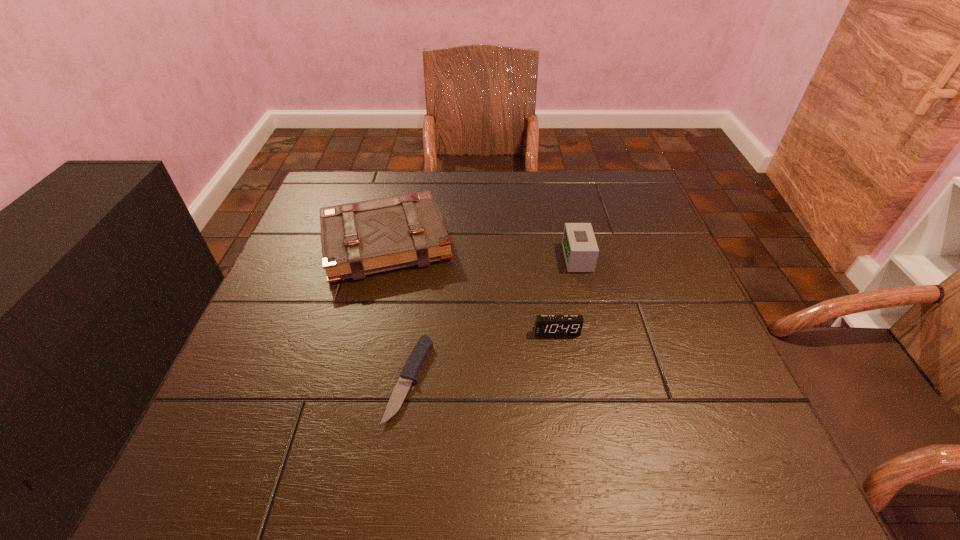
Where is `vacant area at the far left corner of the desktop`? The height and width of the screenshot is (540, 960). vacant area at the far left corner of the desktop is located at coordinates (335, 197).

Locate an element on the screen. vacant space that's between the hardback book and the farther alarm clock is located at coordinates (482, 249).

Where is `empty space between the farther alarm clock and the steak knife`? The image size is (960, 540). empty space between the farther alarm clock and the steak knife is located at coordinates pyautogui.click(x=493, y=318).

Where is `empty space that is in between the taller alarm clock and the nearest object`? The image size is (960, 540). empty space that is in between the taller alarm clock and the nearest object is located at coordinates (493, 318).

This screenshot has height=540, width=960. I want to click on vacant space that's between the taller alarm clock and the hardback book, so click(x=482, y=249).

Where is `vacant area between the hardback book and the left alarm clock`? This screenshot has height=540, width=960. vacant area between the hardback book and the left alarm clock is located at coordinates (471, 287).

I want to click on vacant space in between the taller alarm clock and the left alarm clock, so click(567, 294).

The image size is (960, 540). Identify the location of free space between the nearest object and the right alarm clock. coord(493,318).

The width and height of the screenshot is (960, 540). What are the coordinates of `free space between the hardback book and the steak knife` in the screenshot? It's located at (397, 310).

I want to click on vacant area that lies between the second nearest object and the farther alarm clock, so click(567, 294).